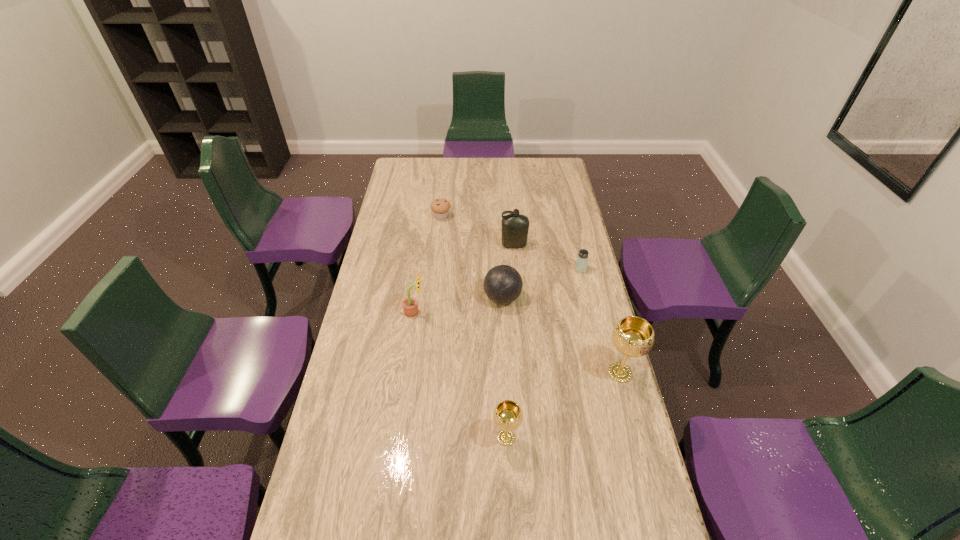
This screenshot has width=960, height=540. Identify the location of the nearer chalice. (507, 415).

This screenshot has width=960, height=540. I want to click on the left chalice, so click(507, 415).

This screenshot has height=540, width=960. I want to click on the taller chalice, so (x=633, y=336).

This screenshot has height=540, width=960. What are the coordinates of `the sixth farthest object` in the screenshot? It's located at (633, 336).

At what (x,y) coordinates should I click in order to perform the action: click on saltshaker. Please return your answer as a coordinate pair (x, y). The image size is (960, 540). Looking at the image, I should click on (582, 258).

Locate an element on the screen. The image size is (960, 540). muffin is located at coordinates (440, 207).

Where is `bowling ball`? The image size is (960, 540). bowling ball is located at coordinates (503, 284).

The height and width of the screenshot is (540, 960). In order to click on sunflower in this screenshot , I will do `click(410, 307)`.

This screenshot has height=540, width=960. Identify the location of bottle. (515, 227).

At what (x,y) coordinates should I click in order to perform the action: click on free space located on the right of the left chalice. Please return your answer as a coordinate pair (x, y). The width and height of the screenshot is (960, 540). Looking at the image, I should click on (568, 437).